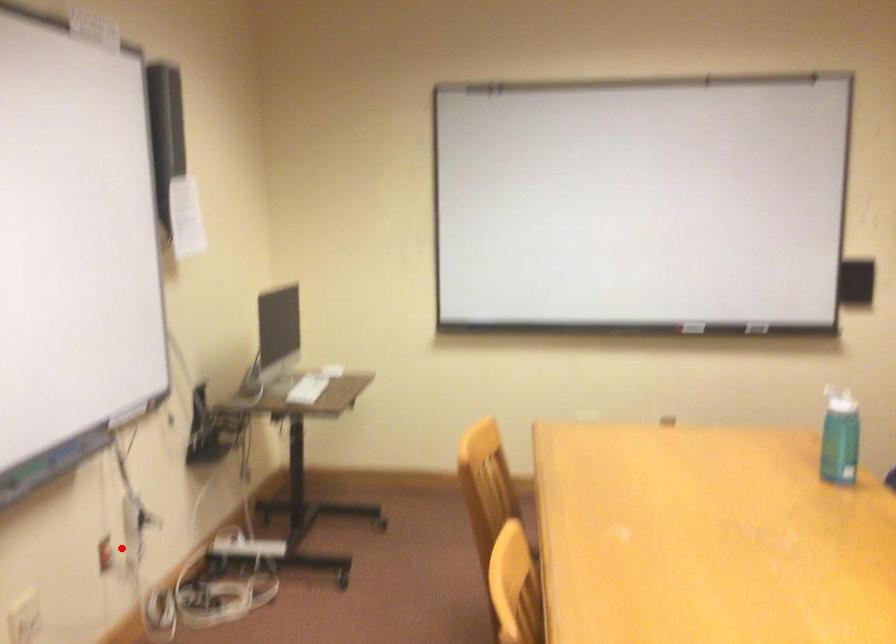
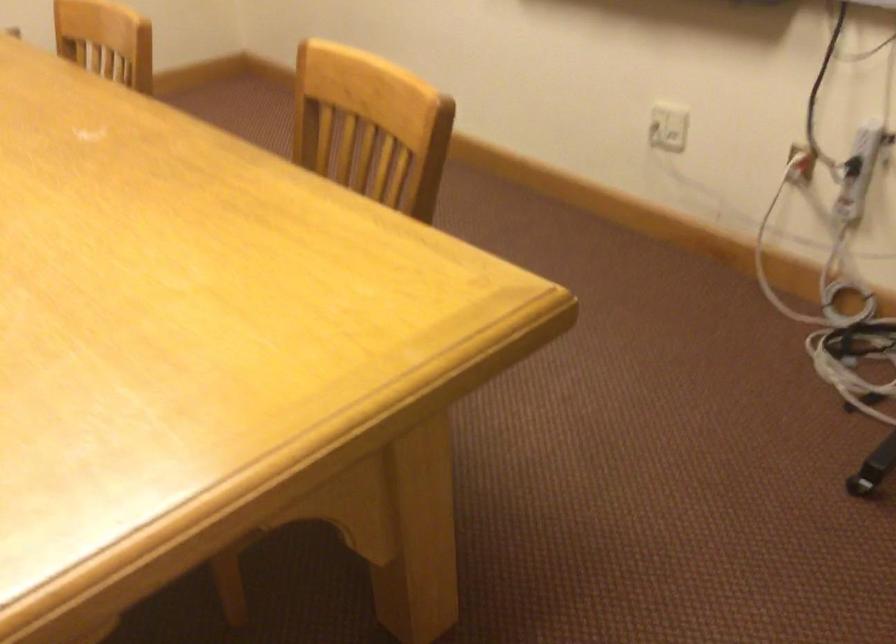
Locate, in the second image, the point that corresponds to the highlighted location in the first image.

(800, 164)